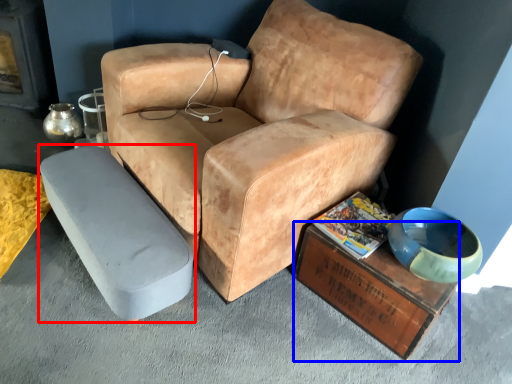
Question: Which object appears farthest to the camera in this image, table (highlighted by a red box) or table (highlighted by a blue box)?

Choices:
 (A) table
 (B) table

Answer: (B)